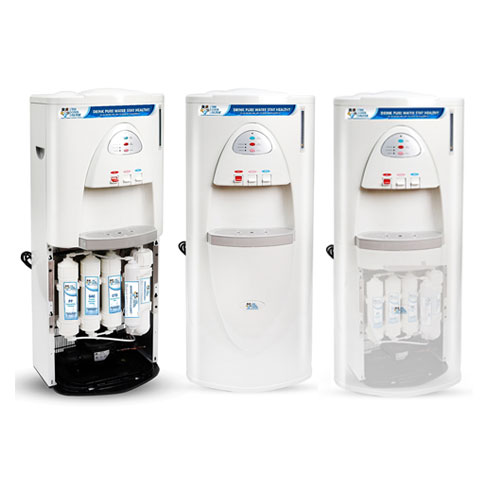
The height and width of the screenshot is (500, 500). What are the coordinates of `orange light` in the screenshot? It's located at (252, 172), (251, 150), (401, 153), (398, 173), (126, 171), (126, 151).